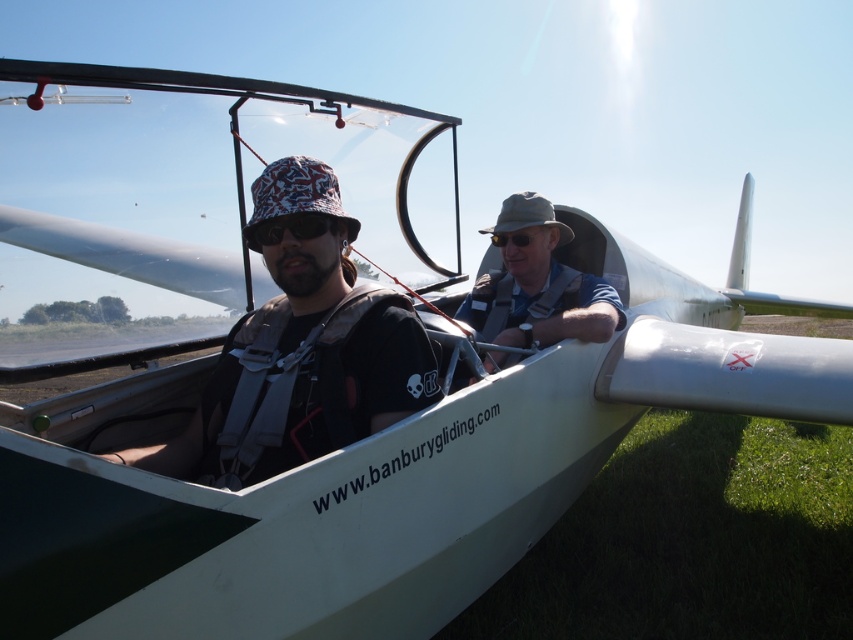
Is matte plastic goggles at center to the right of matte black goggles at center from the viewer's perspective?

No, matte plastic goggles at center is not to the right of matte black goggles at center.

Is point (302, 218) farther from viewer compared to point (495, 244)?

No.

At what (x,y) coordinates should I click in order to perform the action: click on matte plastic goggles at center. Please return your answer as a coordinate pair (x, y). The width and height of the screenshot is (853, 640). Looking at the image, I should click on (289, 228).

Does light brown fabric hat at center appear under matte black goggles at center?

Yes, light brown fabric hat at center is below matte black goggles at center.

Describe the element at coordinates (538, 288) in the screenshot. I see `light brown fabric hat at center` at that location.

I want to click on light brown fabric hat at center, so click(x=538, y=288).

Measure the distance between matte black helmet at center and camera.

matte black helmet at center and camera are 1.54 meters apart.

Can you confirm if matte black helmet at center is positioned to the right of light brown fabric hat at center?

No, matte black helmet at center is not to the right of light brown fabric hat at center.

Between point (289, 458) and point (561, 324), which one is positioned behind?

The point (561, 324) is more distant.

Where is `matte black helmet at center`? Image resolution: width=853 pixels, height=640 pixels. matte black helmet at center is located at coordinates (300, 353).